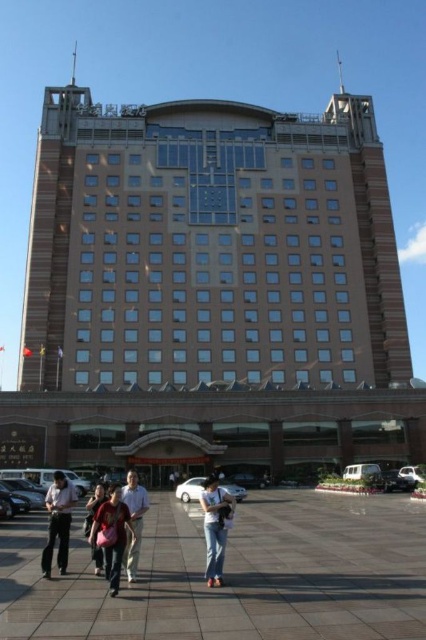
Can you confirm if matte pink jacket at center is thinner than light brown leather jacket at lower center?

Yes.

Which is in front, point (109, 548) or point (92, 548)?

Point (109, 548)

Locate an element on the screen. This screenshot has height=640, width=426. matte pink jacket at center is located at coordinates (111, 536).

Is matte pink jacket at center wider than light beige shirt at center?

No, matte pink jacket at center is not wider than light beige shirt at center.

Is matte pink jacket at center taller than light beige shirt at center?

No, matte pink jacket at center is not taller than light beige shirt at center.

Is point (106, 528) positioned in front of point (124, 557)?

That is True.

I want to click on matte pink jacket at center, so click(x=111, y=536).

Does denim jeans at center appear on the right side of light beige shirt at center?

Indeed, denim jeans at center is positioned on the right side of light beige shirt at center.

Is denim jeans at center above light beige shirt at center?

Actually, denim jeans at center is below light beige shirt at center.

The image size is (426, 640). What do you see at coordinates (215, 528) in the screenshot? I see `denim jeans at center` at bounding box center [215, 528].

Image resolution: width=426 pixels, height=640 pixels. What are the coordinates of `denim jeans at center` in the screenshot? It's located at (215, 528).